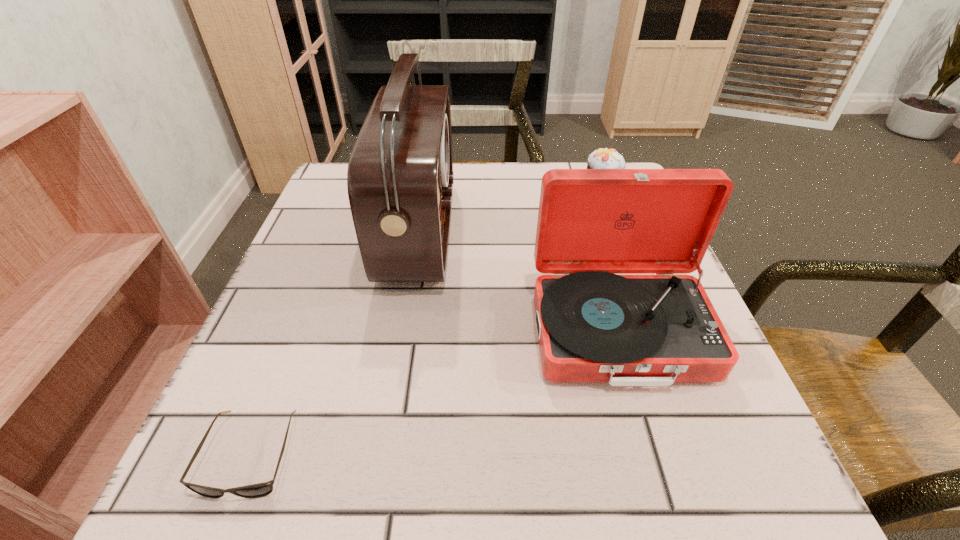
Identify which object is located as the third nearest to the radio receiver. Please provide its 2D coordinates. Your answer should be formatted as a tuple, i.e. [(x, y)], where the tuple contains the x and y coordinates of a point satisfying the conditions above.

[(601, 158)]

Identify which object is located as the third nearest to the sunglasses. Please provide its 2D coordinates. Your answer should be formatted as a tuple, i.e. [(x, y)], where the tuple contains the x and y coordinates of a point satisfying the conditions above.

[(601, 158)]